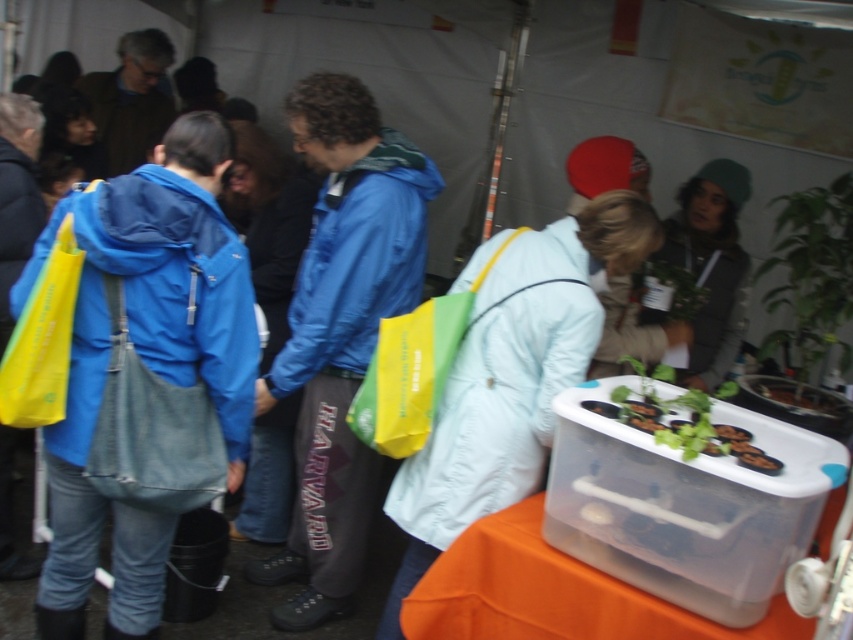
Question: Which of the following is the closest to the observer?

Choices:
 (A) [146, 88]
 (B) [126, 301]

Answer: (B)

Question: Observing the image, what is the correct spatial positioning of blue fabric jacket at upper left in reference to black matte eggplant at lower right?

Choices:
 (A) right
 (B) left

Answer: (B)

Question: Considering the relative positions of blue fabric jacket at center and black matte food at lower right in the image provided, where is blue fabric jacket at center located with respect to black matte food at lower right?

Choices:
 (A) left
 (B) right

Answer: (A)

Question: Which point appears farthest from the camera in this image?

Choices:
 (A) (740, 438)
 (B) (767, 458)
 (C) (315, 307)

Answer: (C)

Question: Can you confirm if blue fabric jacket at left is smaller than black matte eggplant at lower right?

Choices:
 (A) no
 (B) yes

Answer: (A)

Question: Which of the following is the farthest from the observer?

Choices:
 (A) (799, 259)
 (B) (56, 216)
 (C) (352, 330)
 (D) (138, 129)

Answer: (D)